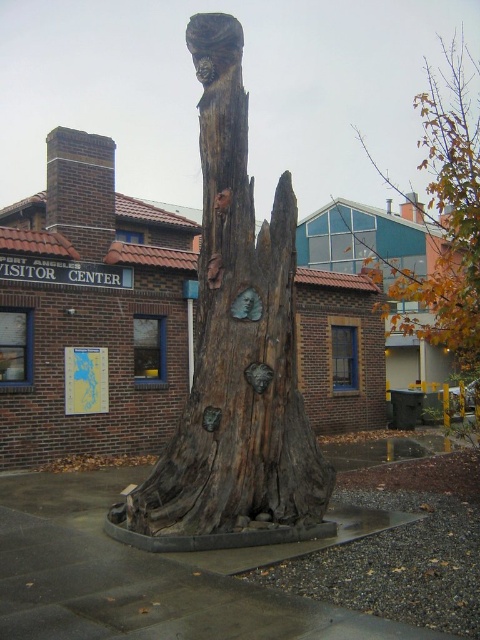
Is point (276, 192) more distant than point (446, 83)?

No.

Measure the distance from weathered wood tree trunk at center to brown wood tree trunk at upper right.

weathered wood tree trunk at center is 42.83 feet away from brown wood tree trunk at upper right.

Locate an element on the screen. Image resolution: width=480 pixels, height=640 pixels. weathered wood tree trunk at center is located at coordinates (236, 344).